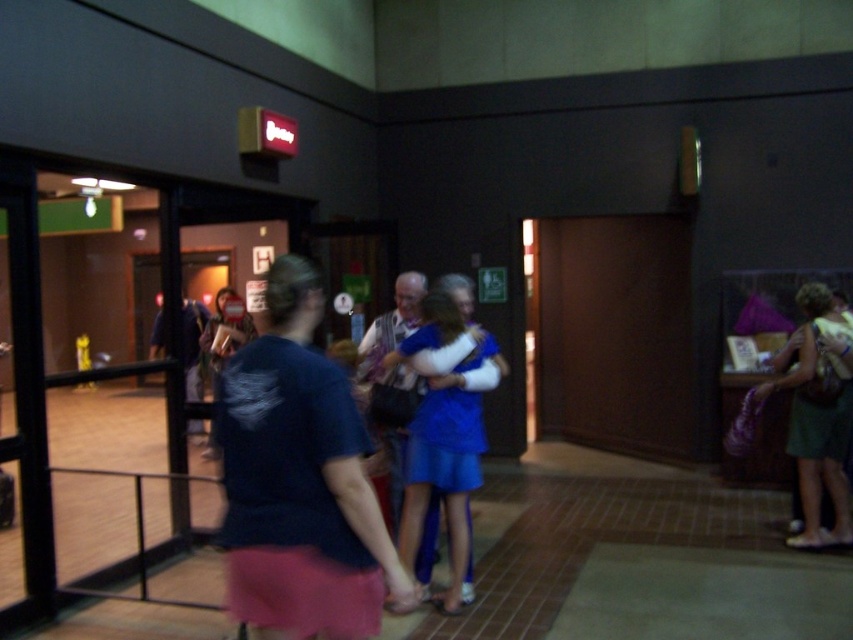
Consider the image. Can you confirm if blue satin dress at center is bigger than matte blue dress at center?

Incorrect, blue satin dress at center is not larger than matte blue dress at center.

Between point (405, 525) and point (218, 321), which one is positioned in front?

Point (405, 525) is more forward.

Who is more distant from viewer, (471,419) or (207,442)?

The point (207,442) is more distant.

The width and height of the screenshot is (853, 640). In order to click on blue satin dress at center in this screenshot , I will do `click(445, 467)`.

Does dark blue shirt at center have a greater height compared to blue satin dress at center?

No.

Describe the element at coordinates (299, 481) in the screenshot. I see `dark blue shirt at center` at that location.

Find the location of a particular element. dark blue shirt at center is located at coordinates (299, 481).

Between dark blue shirt at center and green fabric dress at right, which one appears on the right side from the viewer's perspective?

Positioned to the right is green fabric dress at right.

Which is behind, point (361, 470) or point (827, 289)?

The point (827, 289) is more distant.

Locate an element on the screen. This screenshot has width=853, height=640. dark blue shirt at center is located at coordinates (299, 481).